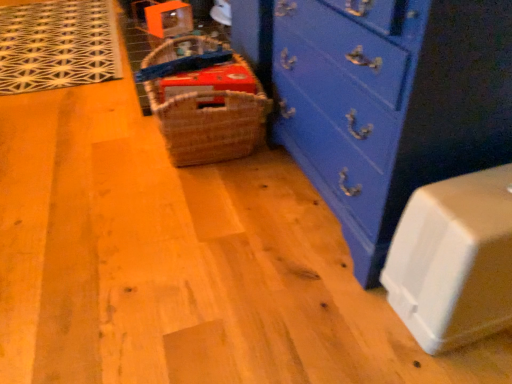
Identify the location of vacant area in front of woven brown basket at center. (178, 207).